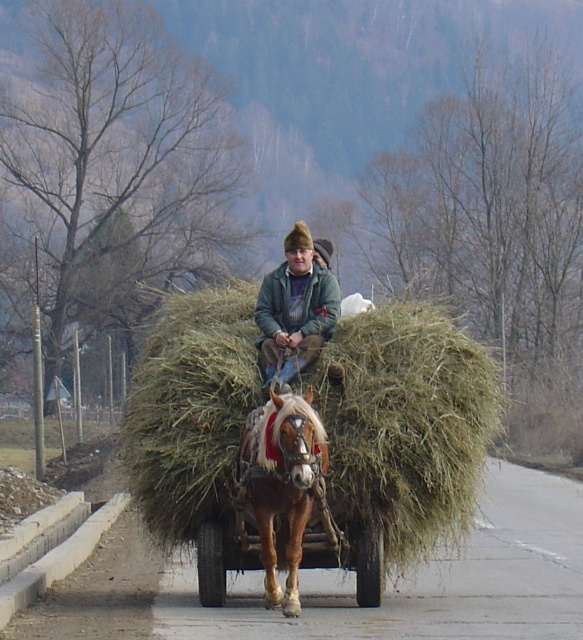
Is green grassy hay at center further to the viewer compared to brown glossy horse at center?

Yes, green grassy hay at center is behind brown glossy horse at center.

Does green grassy hay at center have a larger size compared to brown glossy horse at center?

Correct, green grassy hay at center is larger in size than brown glossy horse at center.

The height and width of the screenshot is (640, 583). I want to click on green grassy hay at center, so click(x=409, y=420).

Identify the location of green grassy hay at center. (409, 420).

Does brown glossy horse at center have a lesser height compared to green woolen jacket at center?

No.

Measure the distance between point (266, 566) and camera.

Point (266, 566) and camera are 9.34 meters apart from each other.

At what (x,y) coordinates should I click in order to perform the action: click on brown glossy horse at center. Please return your answer as a coordinate pair (x, y). The width and height of the screenshot is (583, 640). Looking at the image, I should click on (282, 483).

Can you confirm if green grassy hay at center is positioned below green woolen jacket at center?

Yes.

Is point (423, 477) farther from camera compared to point (304, 225)?

No, (423, 477) is closer to viewer.

At what (x,y) coordinates should I click in order to perform the action: click on green grassy hay at center. Please return your answer as a coordinate pair (x, y). Image resolution: width=583 pixels, height=640 pixels. Looking at the image, I should click on (409, 420).